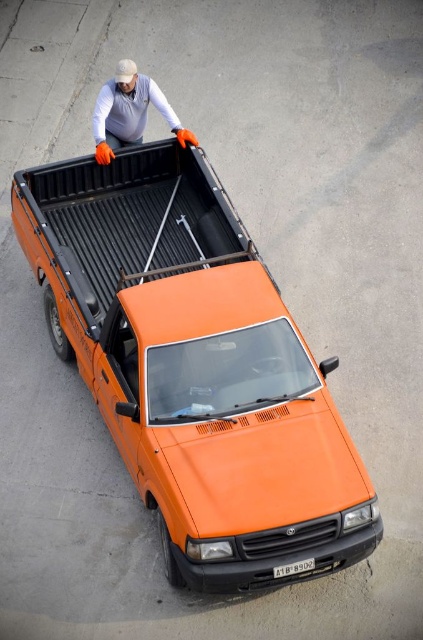
Question: Is matte white shirt at upper center in front of black plastic license plate at bottom center?

Choices:
 (A) yes
 (B) no

Answer: (B)

Question: Which point is closer to the camera?

Choices:
 (A) (153, 182)
 (B) (304, 572)

Answer: (B)

Question: Which of these objects is positioned farthest from the black plastic license plate at bottom center?

Choices:
 (A) matte white shirt at upper center
 (B) orange matte truck at center

Answer: (A)

Question: Is orange matte truck at center thinner than black plastic license plate at bottom center?

Choices:
 (A) no
 (B) yes

Answer: (A)

Question: Which of the following is the farthest from the observer?

Choices:
 (A) matte white shirt at upper center
 (B) orange matte truck at center
 (C) black plastic license plate at bottom center

Answer: (A)

Question: Does orange matte truck at center have a smaller size compared to matte white shirt at upper center?

Choices:
 (A) no
 (B) yes

Answer: (A)